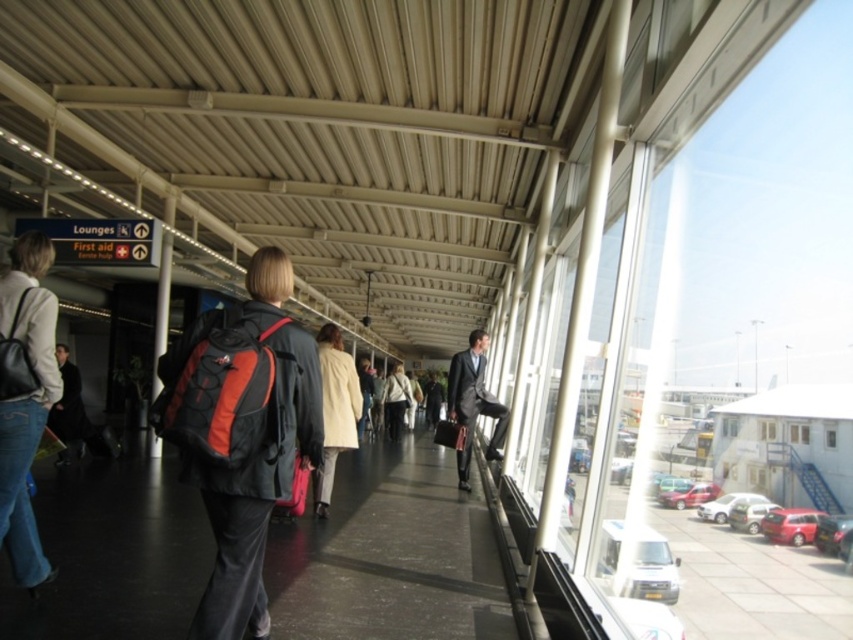
You are a traveler standing at the entrance of the airport corridor. You see a denim jacket at left and a light beige jacket at center. Which jacket is positioned higher up in the image?

The denim jacket at left is positioned higher up in the image than the light beige jacket at center.

You are standing in the airport terminal corridor and see the denim jacket at left and the matte black suit at center. Which person is closer to the glass windows that provide a view of parked cars?

The denim jacket at left is closer to the glass windows because it is positioned to the left of the matte black suit at center, and the windows are on one side of the corridor.

You are a delivery robot in an airport terminal. You need to move a package from the matte black backpack at center to the light beige jacket at center. What is the minimum distance you need to travel?

The minimum distance you need to travel is 10.87 meters between the matte black backpack at center and the light beige jacket at center.